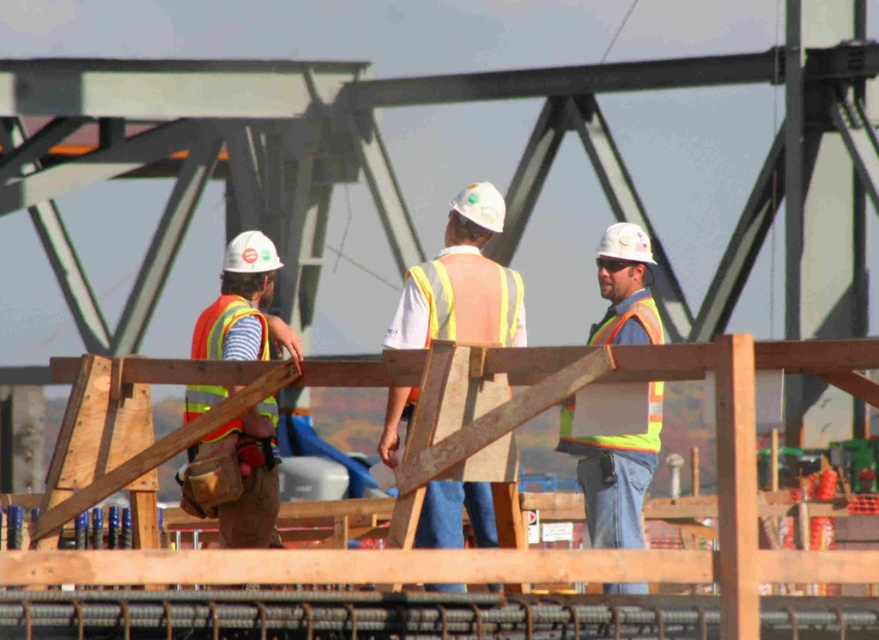
Question: Which of the following is the closest to the observer?

Choices:
 (A) reflective orange safety vest at left
 (B) reflective yellow-green safety vest at right
 (C) reflective yellow vest at center

Answer: (B)

Question: In this image, where is reflective orange vest at center located relative to reflective orange safety vest at left?

Choices:
 (A) above
 (B) below

Answer: (B)

Question: Estimate the real-world distances between objects in this image. Which object is farther from the reflective yellow vest at center?

Choices:
 (A) reflective yellow-green safety vest at right
 (B) reflective orange safety vest at left
 (C) yellow reflective vest at center

Answer: (B)

Question: Which object is positioned farthest from the reflective yellow-green safety vest at right?

Choices:
 (A) reflective yellow vest at center
 (B) reflective orange safety vest at left

Answer: (B)

Question: Can you confirm if reflective orange vest at center is smaller than reflective orange vest at left?

Choices:
 (A) yes
 (B) no

Answer: (B)

Question: Does reflective orange vest at left lie in front of reflective yellow-green safety vest at right?

Choices:
 (A) yes
 (B) no

Answer: (B)